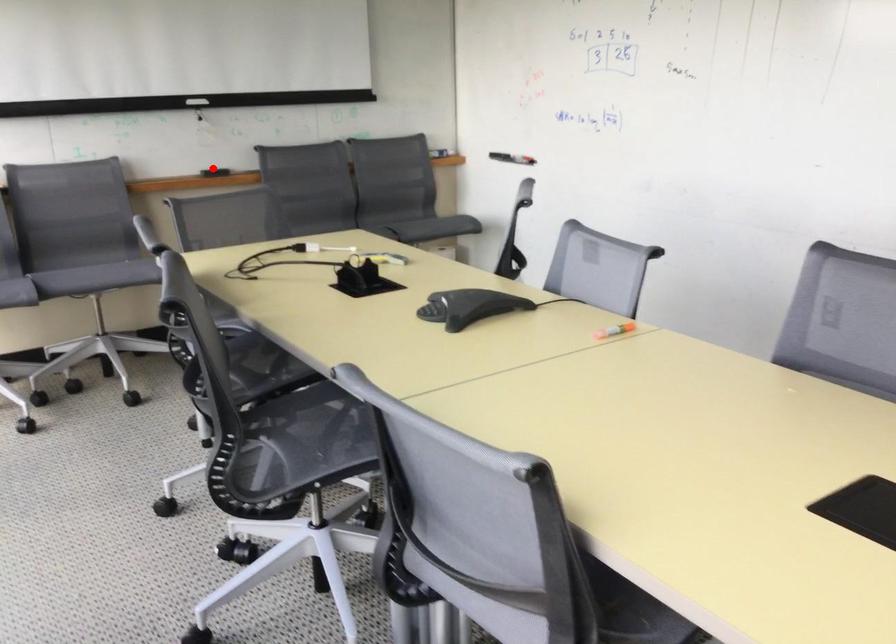
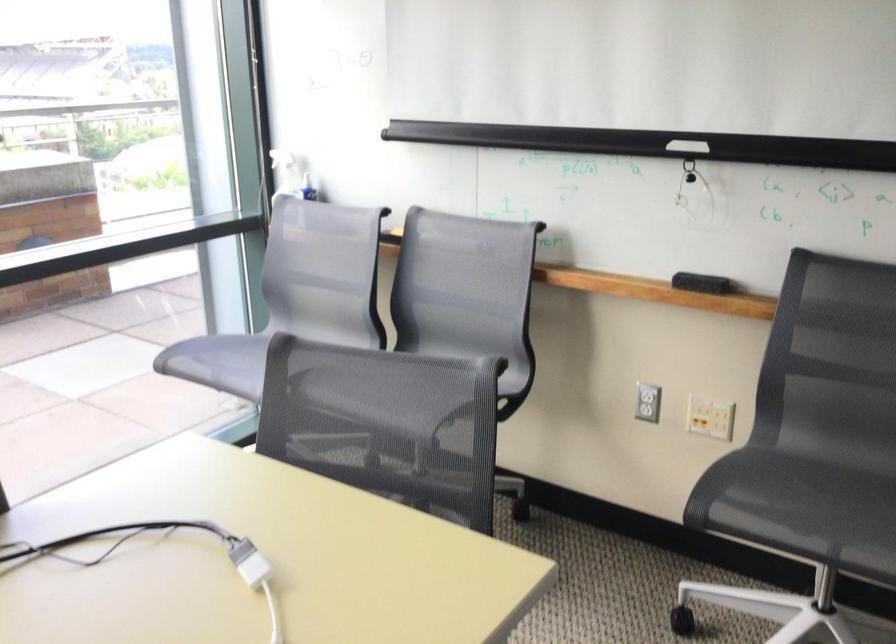
In the second image, find the point that corresponds to the highlighted location in the first image.

(701, 283)